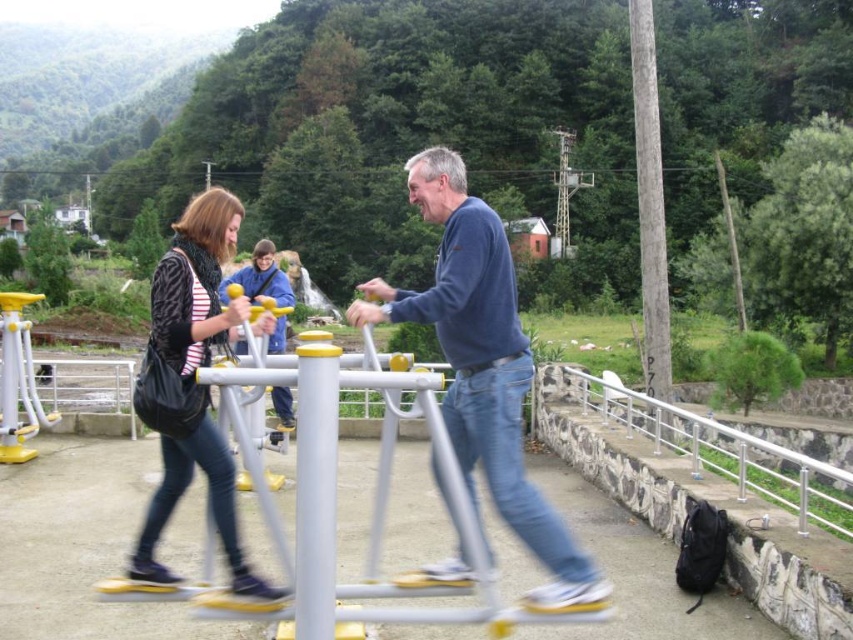
Is point (602, 596) closer to viewer compared to point (828, 518)?

Yes, point (602, 596) is in front of point (828, 518).

How distant is blue cotton sweater at center from satin silver railing at lower right?

4.08 meters

Who is more forward, (485,387) or (735,440)?

Point (485,387)

Where is `blue cotton sweater at center`? Image resolution: width=853 pixels, height=640 pixels. blue cotton sweater at center is located at coordinates (483, 368).

Can you confirm if blue cotton sweater at center is positioned below matte black bag at center?

Yes.

Between blue cotton sweater at center and matte black bag at center, which one has more height?

matte black bag at center is taller.

Is point (556, 544) positioned after point (196, 337)?

No, it is not.

This screenshot has height=640, width=853. I want to click on blue cotton sweater at center, so click(x=483, y=368).

Does matte black bag at center have a lesser height compared to satin silver railing at lower right?

No.

Does matte black bag at center appear over satin silver railing at lower right?

Yes.

Who is more distant from viewer, (223, 236) or (778, 476)?

Positioned behind is point (778, 476).

You are a GUI agent. You are given a task and a screenshot of the screen. Output one action in this format:
    pyautogui.click(x=<x>, y=<y>)
    Task: Click on the matte black bag at center
    The height and width of the screenshot is (640, 853).
    Given the screenshot: What is the action you would take?
    pyautogui.click(x=190, y=385)